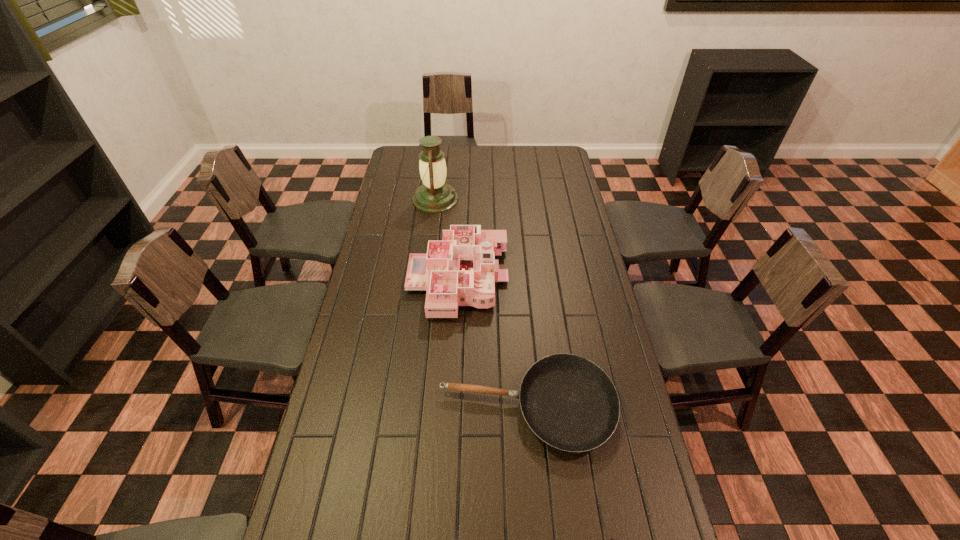
The image size is (960, 540). Identify the location of the farthest object. (434, 195).

The width and height of the screenshot is (960, 540). In order to click on the tallest object in this screenshot , I will do `click(434, 195)`.

Image resolution: width=960 pixels, height=540 pixels. Identify the location of the third shortest object. (460, 270).

What are the coordinates of `dollhouse` in the screenshot? It's located at (460, 270).

Locate an element on the screen. The width and height of the screenshot is (960, 540). the second nearest object is located at coordinates (570, 403).

Locate an element on the screen. This screenshot has height=540, width=960. frying pan is located at coordinates (570, 403).

The image size is (960, 540). Find the location of `free space located with the light compartment facing forward on the farthest object`. free space located with the light compartment facing forward on the farthest object is located at coordinates (484, 199).

This screenshot has width=960, height=540. Find the location of `free location located 0.090m at the front entrance of the second tallest object`. free location located 0.090m at the front entrance of the second tallest object is located at coordinates (532, 279).

You are a GUI agent. You are given a task and a screenshot of the screen. Output one action in this format:
    pyautogui.click(x=<x>, y=<y>)
    Task: Click on the vacant area located on the left of the frying pan
    
    Given the screenshot: What is the action you would take?
    pyautogui.click(x=398, y=407)

This screenshot has width=960, height=540. What are the coordinates of `object present at the left edge` in the screenshot? It's located at pos(434,195).